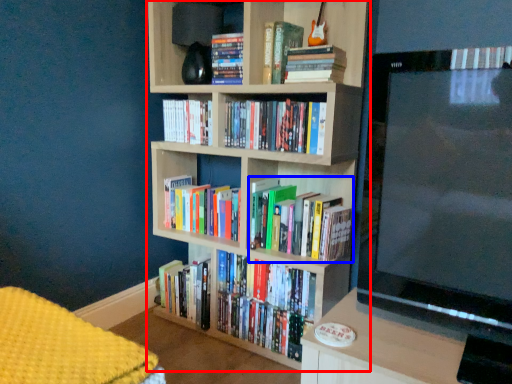
Question: Which object is further to the camera taking this photo, bookcase (highlighted by a red box) or book (highlighted by a blue box)?

Choices:
 (A) bookcase
 (B) book

Answer: (B)